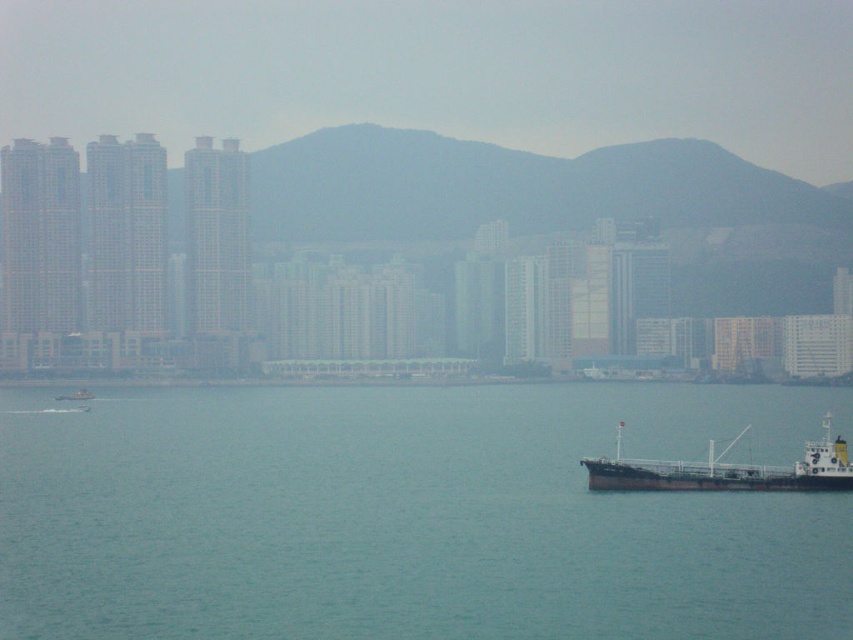
Question: Does clear blue water at center appear on the right side of metallic gray boat at lower left?

Choices:
 (A) yes
 (B) no

Answer: (A)

Question: Which object is positioned farthest from the metallic gray boat at lower left?

Choices:
 (A) brown matte cargo ship at lower right
 (B) clear blue water at center

Answer: (A)

Question: Can you confirm if clear blue water at center is positioned to the left of brown matte cargo ship at lower right?

Choices:
 (A) no
 (B) yes

Answer: (B)

Question: Can you confirm if brown matte cargo ship at lower right is thinner than metallic gray boat at lower left?

Choices:
 (A) yes
 (B) no

Answer: (B)

Question: Considering the real-world distances, which object is farthest from the brown matte cargo ship at lower right?

Choices:
 (A) metallic gray boat at lower left
 (B) clear blue water at center

Answer: (A)

Question: Which is farther from the brown matte cargo ship at lower right?

Choices:
 (A) metallic gray boat at lower left
 (B) clear blue water at center

Answer: (A)